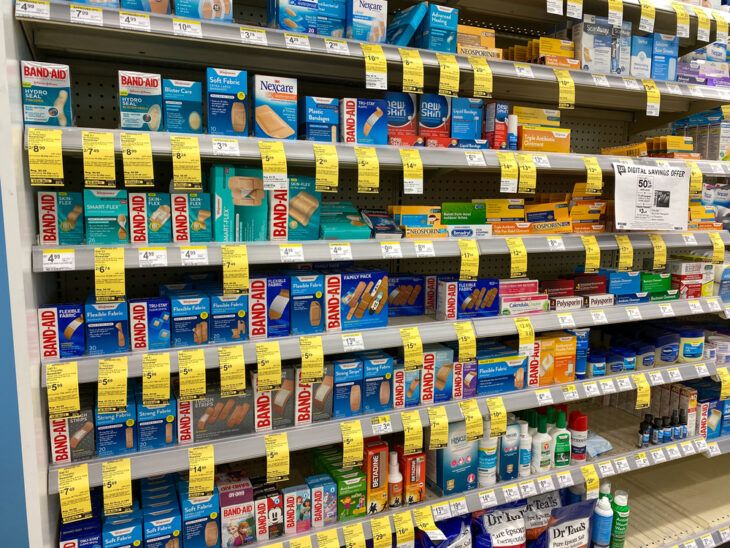
Where is `blue wall to the far left`? This screenshot has width=730, height=548. blue wall to the far left is located at coordinates (7, 462).